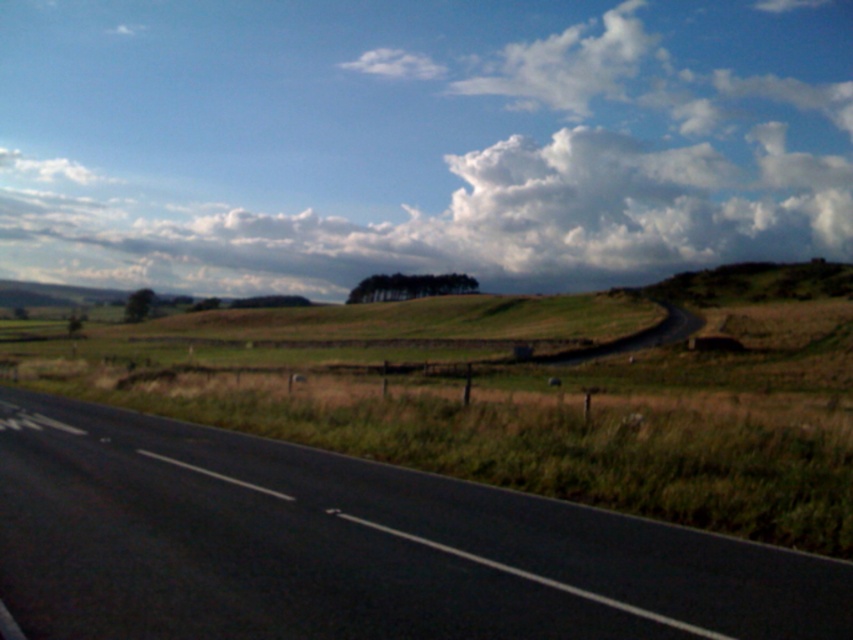
You are driving a truck that is 2.5 meters wide. You see the white fluffy cloud at upper center and the black asphalt highway at lower left. Which one is wider?

The white fluffy cloud at upper center is wider than the black asphalt highway at lower left according to the description.

You are a photographer planning to capture the black asphalt highway at lower left and the white fluffy cloud at upper center in the same frame. Based on their positions, which object would appear closer to the camera in the final photograph?

The black asphalt highway at lower left appears closer to the camera because objects lower in the frame typically indicate proximity, while the white fluffy cloud at upper center is higher up, suggesting it is farther away. However, according to the description, the white fluffy cloud at upper center is taller than the black asphalt highway at lower left, which might imply the cloud has a greater vertical dimension but does not directly relate to their spatial depth. In standard perspective, lower objects

You are a drone operator trying to capture a photo of the white fluffy cloud at upper center. The drone is currently at the starting point at coordinates 0,0. What direction should you move the drone to reach the cloud?

The white fluffy cloud at upper center is located at point (419, 140), so you should move the drone northeast to reach it.